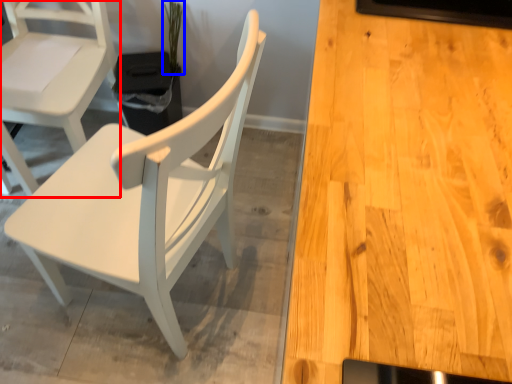
Question: Which object appears closest to the camera in this image, chair (highlighted by a red box) or plant (highlighted by a blue box)?

Choices:
 (A) chair
 (B) plant

Answer: (A)